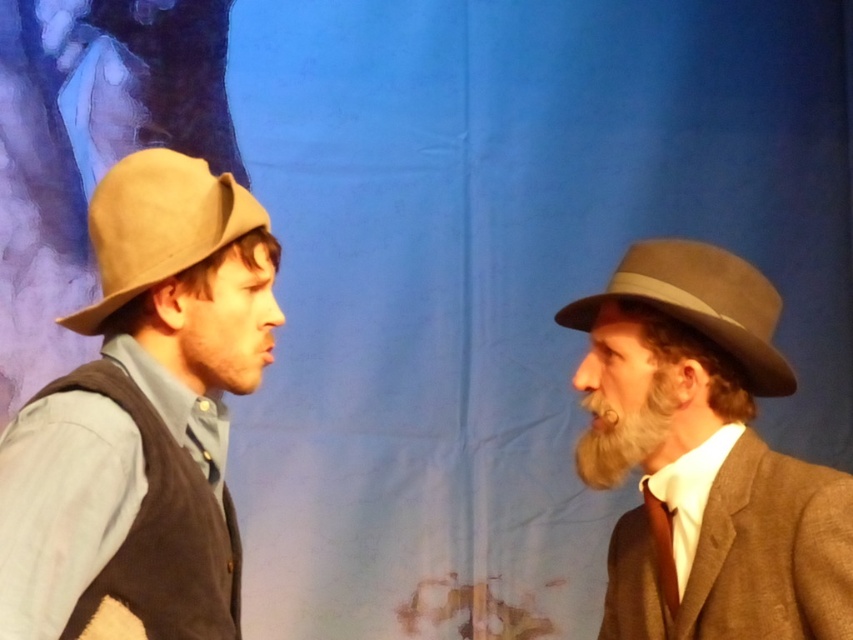
Can you confirm if matte brown hat at left is positioned above graywoollybeard at right?

Yes.

Is point (177, 445) farther from camera compared to point (583, 456)?

No, it is not.

Find the location of a particular element. The height and width of the screenshot is (640, 853). matte brown hat at left is located at coordinates (142, 417).

Does brown felt hat at right have a larger size compared to graywoollybeard at right?

Yes, brown felt hat at right is bigger than graywoollybeard at right.

This screenshot has height=640, width=853. What do you see at coordinates (704, 456) in the screenshot?
I see `brown felt hat at right` at bounding box center [704, 456].

Locate an element on the screen. brown felt hat at right is located at coordinates (704, 456).

Which is behind, point (196, 305) or point (68, 326)?

Point (68, 326)

Is matte brown hat at left positioned at the back of light brown felt fedora at left?

No, matte brown hat at left is closer to the viewer.

Between point (216, 177) and point (134, 227), which one is positioned in front?

Point (134, 227) is more forward.

In order to click on matte brown hat at left in this screenshot , I will do `click(142, 417)`.